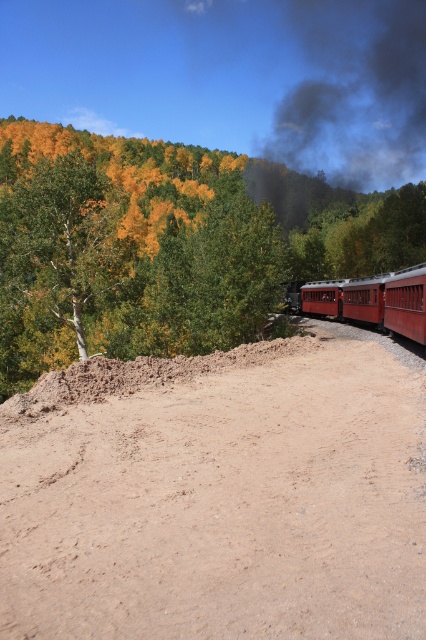
Between smooth white tree at left and red polished wood train at right, which one has more height?

smooth white tree at left is taller.

Image resolution: width=426 pixels, height=640 pixels. What do you see at coordinates (62, 237) in the screenshot?
I see `smooth white tree at left` at bounding box center [62, 237].

This screenshot has height=640, width=426. Find the location of `smooth white tree at left`. smooth white tree at left is located at coordinates (62, 237).

Does point (388, 352) come in front of point (83, 227)?

Yes, it is.

Between point (155, 492) and point (94, 186), which one is positioned behind?

Positioned behind is point (94, 186).

This screenshot has height=640, width=426. I want to click on brown sandy dirt track at lower center, so click(x=218, y=493).

In order to click on dark gray smoke at upper center in this screenshot , I will do `click(351, 92)`.

Is dark gray smoke at upper center above smooth white tree at left?

Indeed, dark gray smoke at upper center is positioned over smooth white tree at left.

I want to click on dark gray smoke at upper center, so click(351, 92).

Find the location of a particular element. dark gray smoke at upper center is located at coordinates (351, 92).